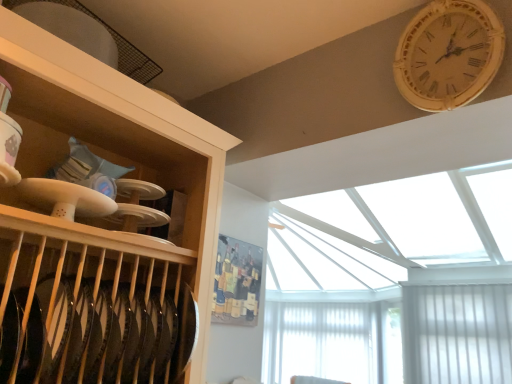
Find the location of a particular element. white wooden clock at upper right is located at coordinates (448, 54).

Describe the element at coordinates (448, 54) in the screenshot. I see `white wooden clock at upper right` at that location.

The width and height of the screenshot is (512, 384). Describe the element at coordinates (332, 342) in the screenshot. I see `white sheer curtain at lower right` at that location.

Where is `white sheer curtain at lower right`? The width and height of the screenshot is (512, 384). white sheer curtain at lower right is located at coordinates (332, 342).

Locate an element on the screen. white wooden clock at upper right is located at coordinates (448, 54).

Visually, is white wooden clock at upper right positioned to the left or to the right of white sheer curtain at lower right?

In the image, white wooden clock at upper right appears on the left side of white sheer curtain at lower right.

Is the position of white wooden clock at upper right more distant than that of white sheer curtain at lower right?

No, the depth of white wooden clock at upper right is less than that of white sheer curtain at lower right.

Between point (428, 20) and point (357, 330), which one is positioned in front?

The point (428, 20) is closer to the camera.

From the image's perspective, who appears lower, white wooden clock at upper right or white sheer curtain at lower right?

From the image's view, white sheer curtain at lower right is below.

From a real-world perspective, is white wooden clock at upper right located higher than white sheer curtain at lower right?

Yes, from a real-world perspective, white wooden clock at upper right is above white sheer curtain at lower right.

Between white wooden clock at upper right and white sheer curtain at lower right, which one has smaller width?

With smaller width is white wooden clock at upper right.

Considering the sizes of white wooden clock at upper right and white sheer curtain at lower right in the image, is white wooden clock at upper right taller or shorter than white sheer curtain at lower right?

Considering their sizes, white wooden clock at upper right has less height than white sheer curtain at lower right.

From the picture: Which of these two, white wooden clock at upper right or white sheer curtain at lower right, is smaller?

Smaller between the two is white wooden clock at upper right.

Is white wooden clock at upper right not inside white sheer curtain at lower right?

That's correct, white wooden clock at upper right is outside of white sheer curtain at lower right.

Is white wooden clock at upper right beside white sheer curtain at lower right?

No.

Is white wooden clock at upper right oriented towards white sheer curtain at lower right?

No.

You are a GUI agent. You are given a task and a screenshot of the screen. Output one action in this format:
    pyautogui.click(x=<x>, y=<y>)
    Task: Click on the wall clock lying on the left of white sheer curtain at lower right
    The width and height of the screenshot is (512, 384).
    Given the screenshot: What is the action you would take?
    pyautogui.click(x=448, y=54)

Is white sheer curtain at lower right at the left side of white wooden clock at upper right?

No.

Considering the positions of objects white sheer curtain at lower right and white wooden clock at upper right in the image provided, who is in front, white sheer curtain at lower right or white wooden clock at upper right?

white wooden clock at upper right.

Considering the points (362, 306) and (465, 54), which point is in front, point (362, 306) or point (465, 54)?

The point (465, 54) is closer.

From the image's perspective, is white sheer curtain at lower right beneath white wooden clock at upper right?

Correct, white sheer curtain at lower right appears lower than white wooden clock at upper right in the image.

Based on the photo, from a real-world perspective, is white sheer curtain at lower right above or below white wooden clock at upper right?

Clearly, from a real-world perspective, white sheer curtain at lower right is below white wooden clock at upper right.

In terms of width, does white sheer curtain at lower right look wider or thinner when compared to white wooden clock at upper right?

In the image, white sheer curtain at lower right appears to be wider than white wooden clock at upper right.

From their relative heights in the image, would you say white sheer curtain at lower right is taller or shorter than white wooden clock at upper right?

Clearly, white sheer curtain at lower right is taller compared to white wooden clock at upper right.

Can you confirm if white sheer curtain at lower right is smaller than white wooden clock at upper right?

Actually, white sheer curtain at lower right might be larger than white wooden clock at upper right.

Is white sheer curtain at lower right surrounding white wooden clock at upper right?

Definitely not — white wooden clock at upper right is not inside white sheer curtain at lower right.

Is the surface of white sheer curtain at lower right in direct contact with white wooden clock at upper right?

white sheer curtain at lower right and white wooden clock at upper right are not in contact.

Looking at this image, is white wooden clock at upper right at the back of white sheer curtain at lower right?

white sheer curtain at lower right does not have its back to white wooden clock at upper right.

This screenshot has height=384, width=512. In order to click on wall clock in front of the white sheer curtain at lower right in this screenshot , I will do `click(448, 54)`.

Find the location of a particular element. This screenshot has height=384, width=512. window screen below the white wooden clock at upper right (from a real-world perspective) is located at coordinates point(332,342).

At what (x,y) coordinates should I click in order to perform the action: click on wall clock that appears on the left of white sheer curtain at lower right. Please return your answer as a coordinate pair (x, y). This screenshot has width=512, height=384. Looking at the image, I should click on [448, 54].